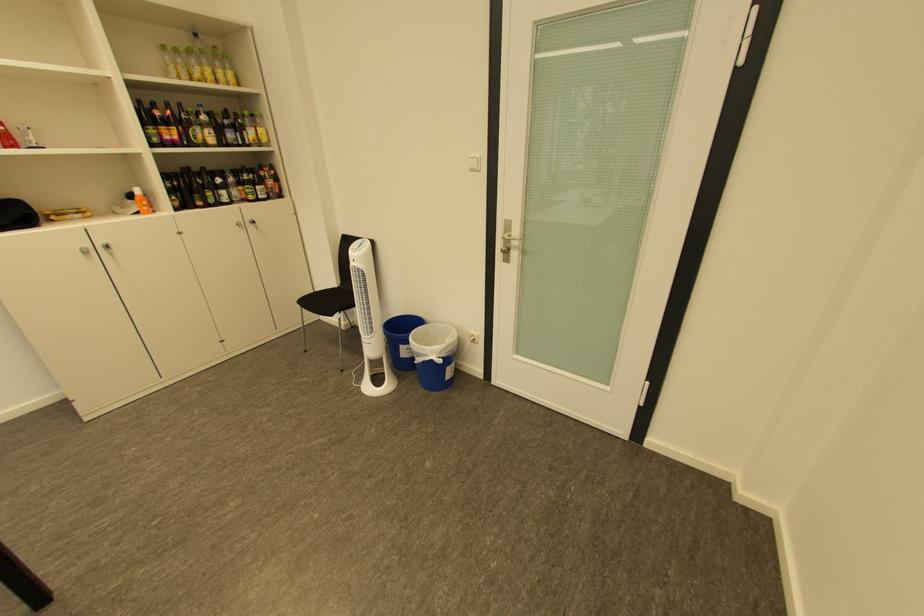
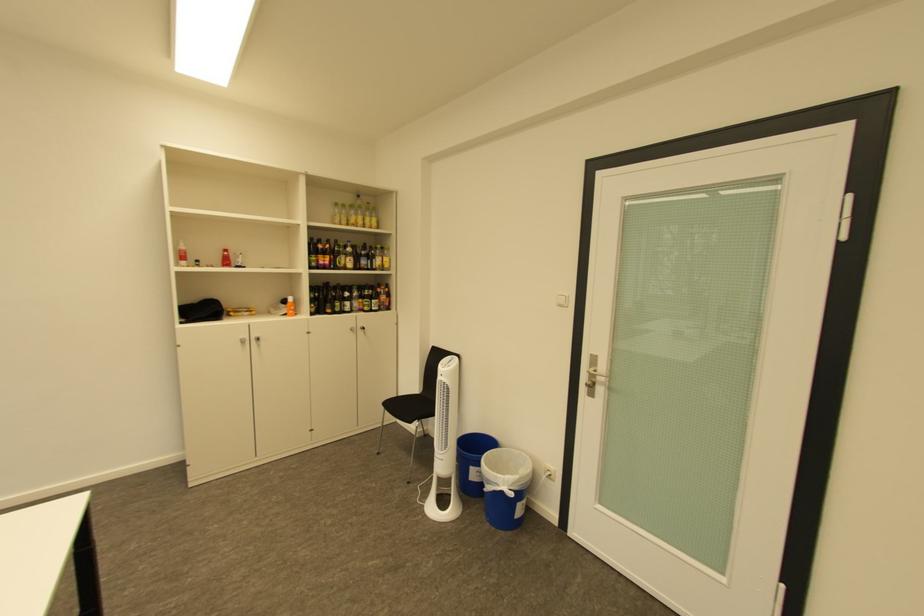
Question: The first image is from the beginning of the video and the second image is from the end. How did the camera likely rotate when shooting the video?

Choices:
 (A) Left
 (B) Right
 (C) Up
 (D) Down

Answer: (C)